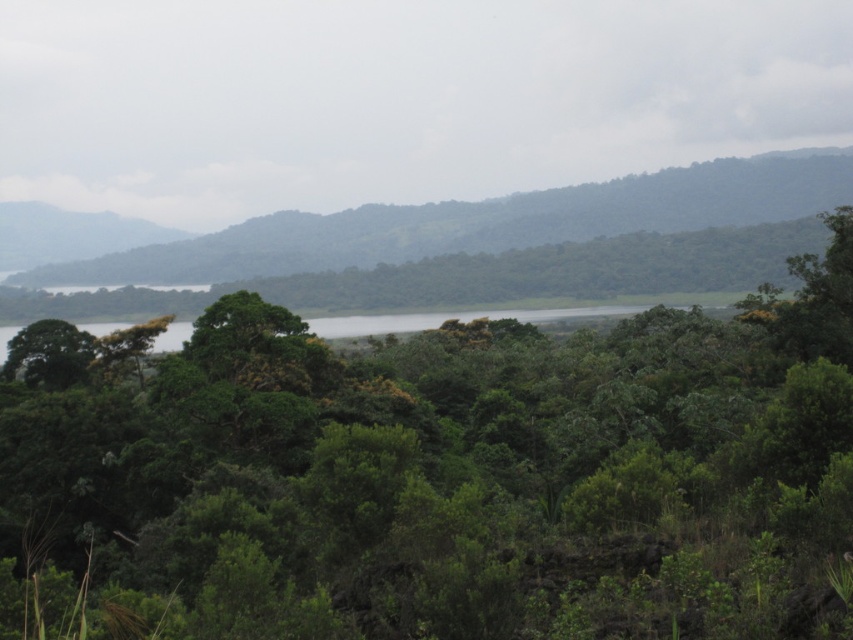
Question: Is green leafy tree at center closer to camera compared to green leafy hillside at center?

Choices:
 (A) no
 (B) yes

Answer: (B)

Question: Can you confirm if green leafy tree at center is thinner than green leafy hillside at center?

Choices:
 (A) no
 (B) yes

Answer: (B)

Question: Is the position of green leafy tree at center less distant than that of green water at center?

Choices:
 (A) no
 (B) yes

Answer: (B)

Question: Among these objects, which one is nearest to the camera?

Choices:
 (A) green leafy hillside at center
 (B) green water at center

Answer: (B)

Question: Which object is farther from the camera taking this photo?

Choices:
 (A) green water at center
 (B) green leafy hillside at center

Answer: (B)

Question: Considering the real-world distances, which object is farthest from the green water at center?

Choices:
 (A) green leafy tree at center
 (B) green leafy hillside at center

Answer: (B)